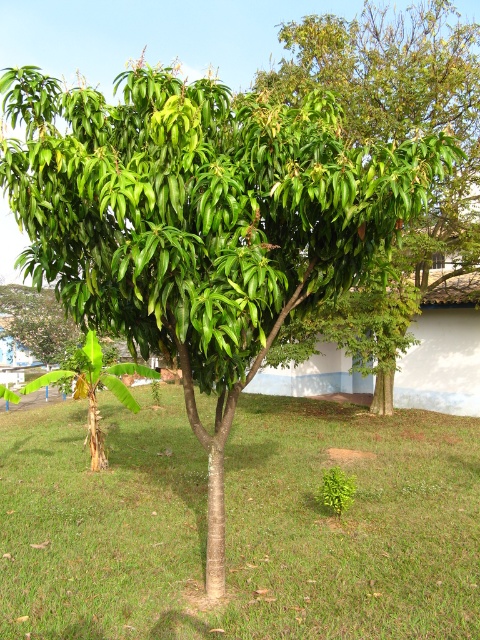
What do you see at coordinates (239, 524) in the screenshot? I see `green grass at center` at bounding box center [239, 524].

Is green grass at center taller than green glossy tree at center?

In fact, green grass at center may be shorter than green glossy tree at center.

Which is in front, point (57, 586) or point (346, 28)?

Positioned in front is point (57, 586).

Identify the location of green grass at center. This screenshot has width=480, height=640. (239, 524).